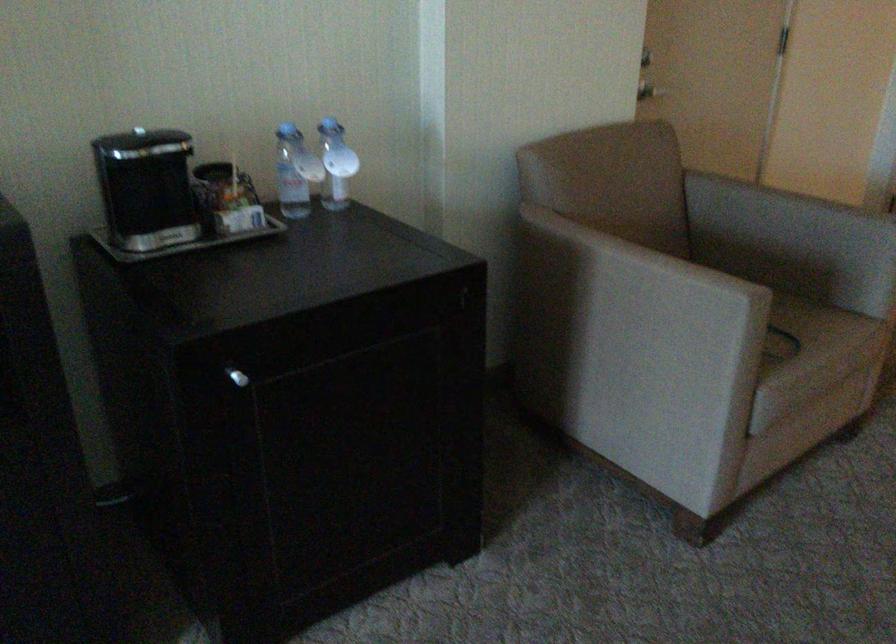
Describe the element at coordinates (237, 377) in the screenshot. Image resolution: width=896 pixels, height=644 pixels. I see `a small silver handle` at that location.